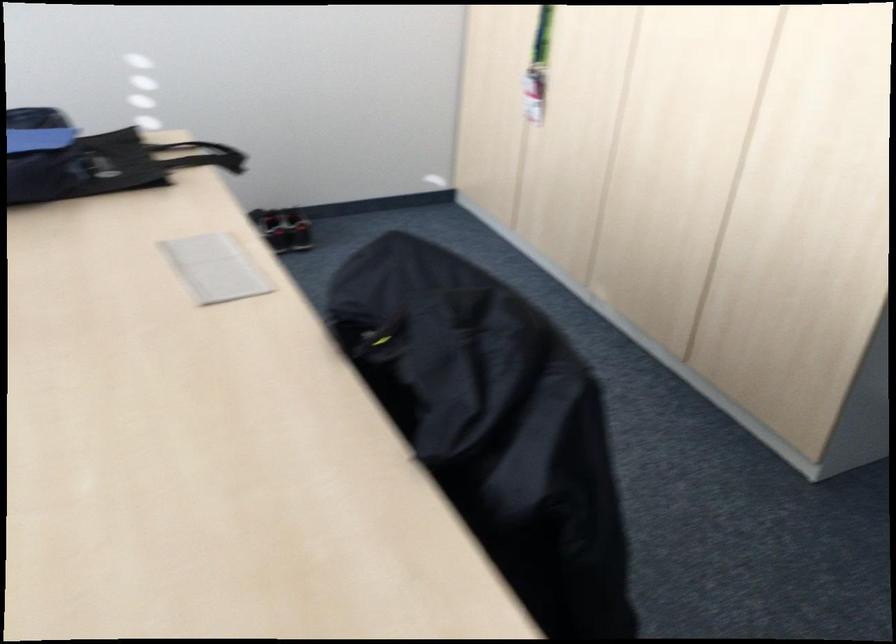
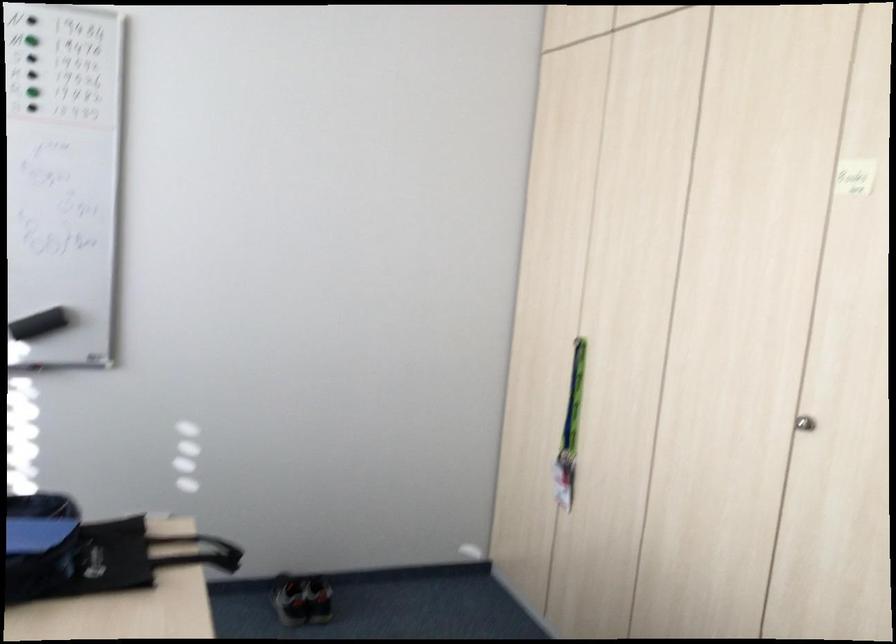
The point at (x=299, y=229) is marked in the first image. Where is the corresponding point in the second image?

(319, 599)